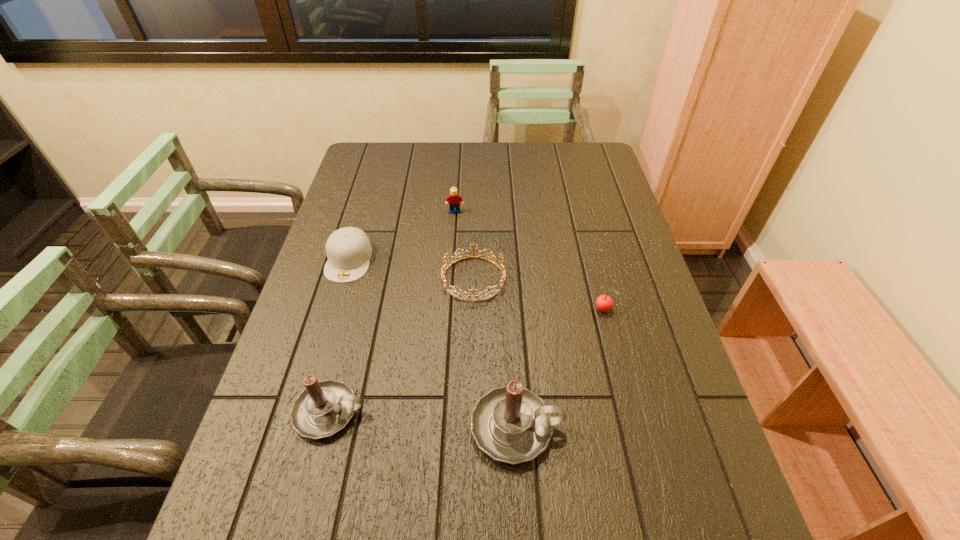
Find the location of a particular element. vacant space at the left edge of the desktop is located at coordinates (348, 285).

I want to click on vacant space at the right edge of the desktop, so click(659, 401).

Locate an element on the screen. This screenshot has width=960, height=540. free point at the far left corner is located at coordinates (400, 148).

Find the location of a particular element. This screenshot has height=540, width=960. vacant space at the near left corner of the desktop is located at coordinates (240, 478).

The width and height of the screenshot is (960, 540). In order to click on empty location between the taller candle and the shorter candle in this screenshot , I will do (x=423, y=420).

At what (x,y) coordinates should I click in order to perform the action: click on free space between the farthest object and the cap. Please return your answer as a coordinate pair (x, y). Looking at the image, I should click on (402, 235).

Find the location of a particular element. free spot between the shortest object and the left candle is located at coordinates click(x=401, y=346).

Identify the location of blank region between the shorter candle and the cherry. This screenshot has width=960, height=540. (467, 361).

This screenshot has width=960, height=540. In order to click on empty space that is in between the shorter candle and the cherry in this screenshot , I will do click(x=467, y=361).

Locate an element on the screen. Image resolution: width=960 pixels, height=540 pixels. free space between the farthest object and the cap is located at coordinates (402, 235).